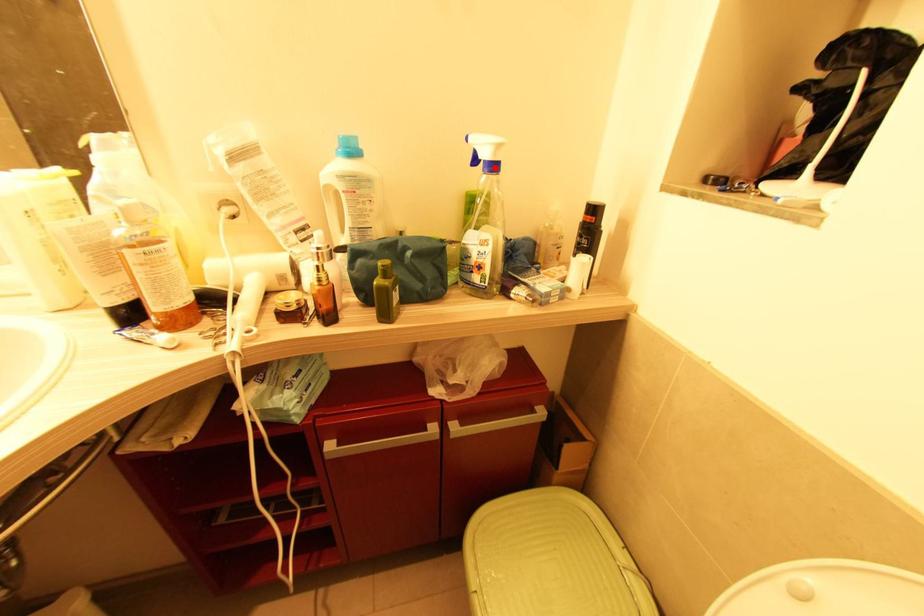
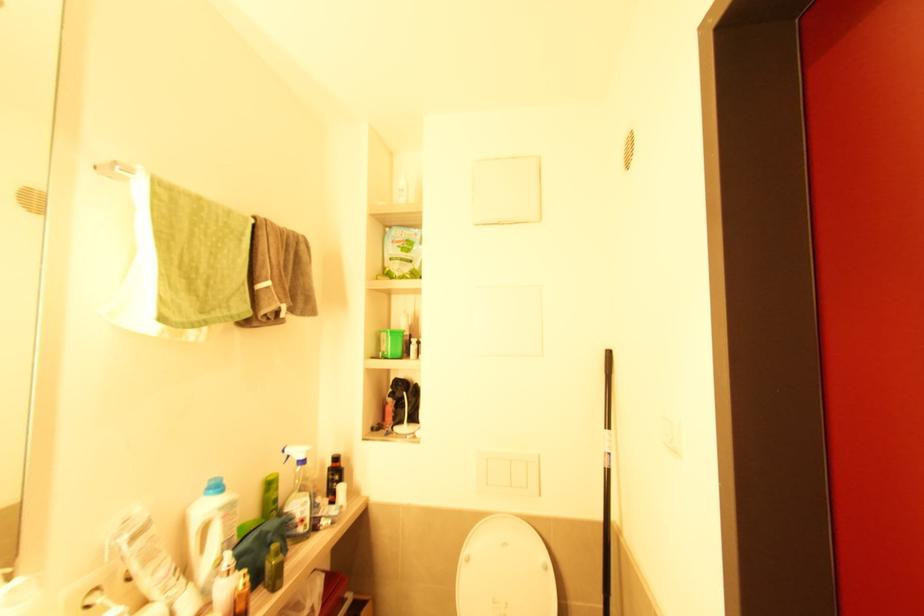
Where in the second image is the point corresponding to the highlighted location from the first image?

(305, 462)